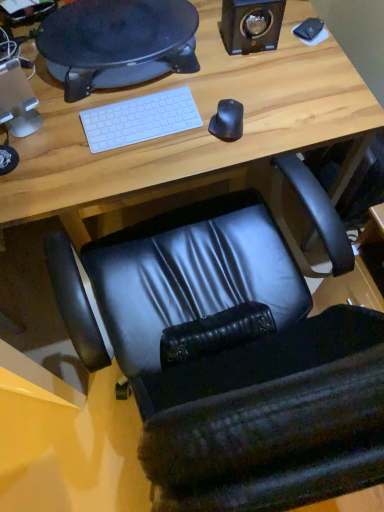
At what (x,y) coordinates should I click in order to perform the action: click on free space in front of black rubber mouse at center. Please return your answer as a coordinate pair (x, y). Image resolution: width=384 pixels, height=512 pixels. Looking at the image, I should click on (219, 156).